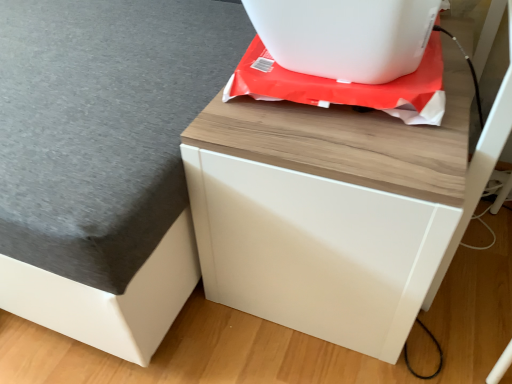
Question: In the image, is white matte drawer at center positioned in front of or behind white plastic appliance at upper center?

Choices:
 (A) front
 (B) behind

Answer: (A)

Question: Is white matte drawer at center inside or outside of white plastic appliance at upper center?

Choices:
 (A) inside
 (B) outside

Answer: (B)

Question: Which is farther from the wooden table at upper right?

Choices:
 (A) white plastic appliance at upper center
 (B) white matte drawer at center

Answer: (A)

Question: Which of these objects is positioned closest to the white plastic appliance at upper center?

Choices:
 (A) white matte drawer at center
 (B) wooden table at upper right

Answer: (A)